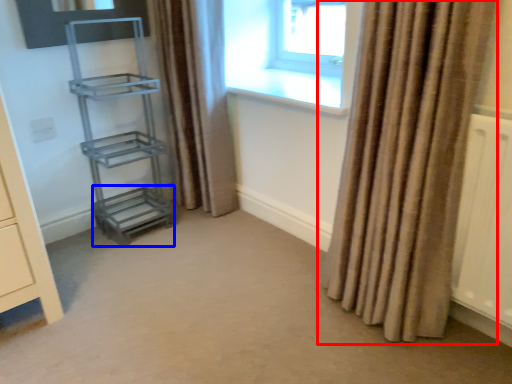
Question: Which object appears farthest to the camera in this image, curtain (highlighted by a red box) or shelf (highlighted by a blue box)?

Choices:
 (A) curtain
 (B) shelf

Answer: (B)